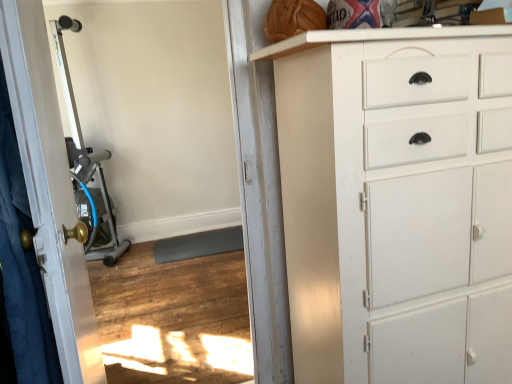
Question: Does silver metallic exercise machine at left have a lesser width compared to silver metallic exercise machine at left?

Choices:
 (A) yes
 (B) no

Answer: (A)

Question: From the image's perspective, is silver metallic exercise machine at left located beneath silver metallic exercise machine at left?

Choices:
 (A) yes
 (B) no

Answer: (A)

Question: From a real-world perspective, is silver metallic exercise machine at left under silver metallic exercise machine at left?

Choices:
 (A) no
 (B) yes

Answer: (B)

Question: Is silver metallic exercise machine at left at the left side of silver metallic exercise machine at left?

Choices:
 (A) no
 (B) yes

Answer: (A)

Question: Is silver metallic exercise machine at left oriented towards silver metallic exercise machine at left?

Choices:
 (A) no
 (B) yes

Answer: (A)

Question: Considering the relative positions of white glossy door at left and silver metallic exercise machine at left in the image provided, is white glossy door at left to the left or to the right of silver metallic exercise machine at left?

Choices:
 (A) left
 (B) right

Answer: (A)

Question: Is white glossy door at left taller or shorter than silver metallic exercise machine at left?

Choices:
 (A) tall
 (B) short

Answer: (B)

Question: Considering their positions, is white glossy door at left located in front of or behind silver metallic exercise machine at left?

Choices:
 (A) behind
 (B) front

Answer: (B)

Question: Does point (20, 44) appear closer or farther from the camera than point (48, 284)?

Choices:
 (A) closer
 (B) farther

Answer: (A)

Question: From their relative heights in the image, would you say silver metallic exercise machine at left is taller or shorter than white glossy door at left?

Choices:
 (A) short
 (B) tall

Answer: (B)

Question: Is silver metallic exercise machine at left to the left or to the right of white glossy door at left in the image?

Choices:
 (A) left
 (B) right

Answer: (A)

Question: Which is correct: silver metallic exercise machine at left is inside white glossy door at left, or outside of it?

Choices:
 (A) outside
 (B) inside

Answer: (A)

Question: Considering the positions of silver metallic exercise machine at left and white glossy door at left in the image, is silver metallic exercise machine at left bigger or smaller than white glossy door at left?

Choices:
 (A) big
 (B) small

Answer: (A)

Question: Considering the positions of white painted wood chest of drawers at right and white glossy door at left in the image, is white painted wood chest of drawers at right taller or shorter than white glossy door at left?

Choices:
 (A) short
 (B) tall

Answer: (B)

Question: From a real-world perspective, relative to white glossy door at left, is white painted wood chest of drawers at right vertically above or below?

Choices:
 (A) below
 (B) above

Answer: (A)